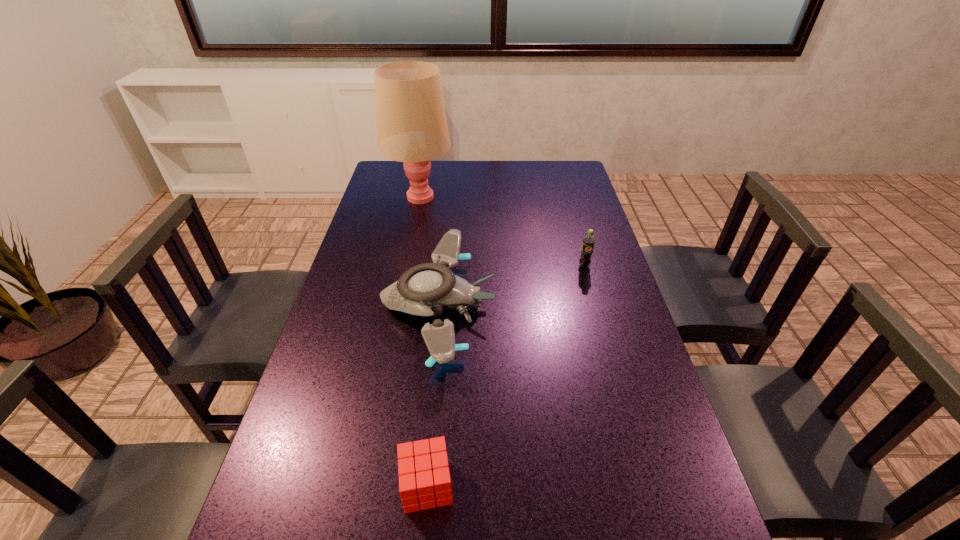
Locate an element on the screen. vacant region located 0.140m on the back of the nearest object is located at coordinates (434, 402).

The height and width of the screenshot is (540, 960). What are the coordinates of `object that is at the far edge` in the screenshot? It's located at (412, 128).

Find the location of `lampshade present at the left edge`. lampshade present at the left edge is located at coordinates (412, 128).

Identify the location of drone present at the left edge. (427, 289).

The width and height of the screenshot is (960, 540). I want to click on object positioned at the right edge, so click(x=588, y=241).

You are a GUI agent. You are given a task and a screenshot of the screen. Output one action in this format:
    pyautogui.click(x=<x>, y=<y>)
    Task: Click on the object positioned at the far left corner
    This screenshot has width=960, height=540.
    Given the screenshot: What is the action you would take?
    pyautogui.click(x=412, y=128)

Find the location of a particular element. The image size is (960, 540). vacant space at the far edge of the desktop is located at coordinates (468, 182).

Image resolution: width=960 pixels, height=540 pixels. I want to click on vacant region at the left edge of the desktop, so click(359, 229).

I want to click on vacant space at the right edge of the desktop, so click(x=644, y=383).

You are a GUI agent. You are given a task and a screenshot of the screen. Output one action in this format:
    pyautogui.click(x=<x>, y=<y>)
    Task: Click on the free space between the nearest object and the drone
    
    Given the screenshot: What is the action you would take?
    pyautogui.click(x=433, y=396)